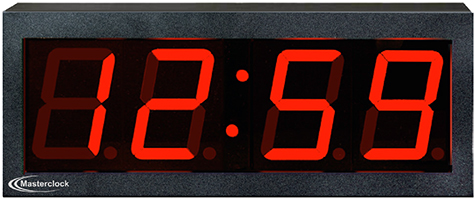
Locate an element on the screen. This screenshot has height=200, width=476. corner of top of clock is located at coordinates (3, 10).